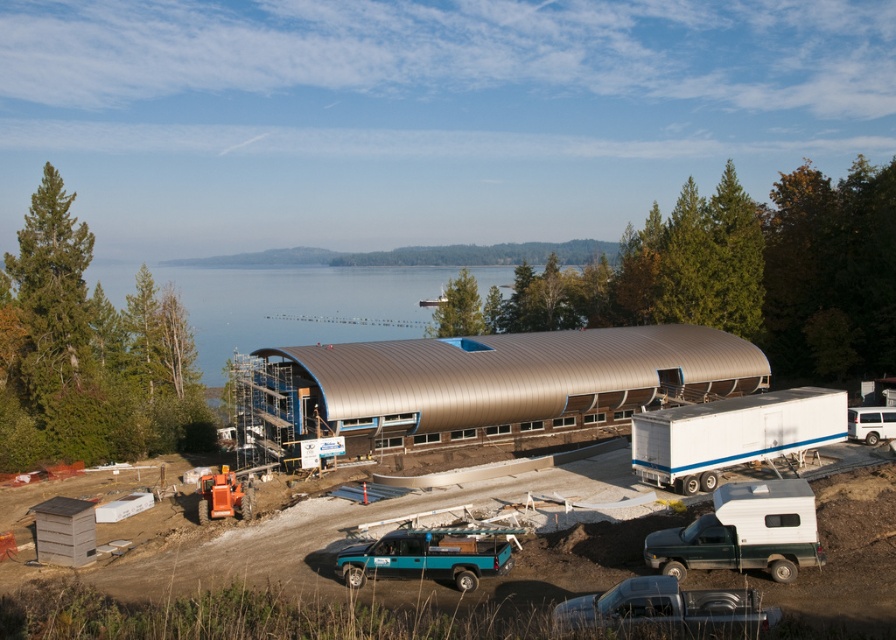
Is metallic water at center thinner than teal matte truck at lower center?

No.

Who is positioned more to the right, metallic water at center or teal matte truck at lower center?

teal matte truck at lower center

Which is in front, point (336, 273) or point (480, 554)?

Positioned in front is point (480, 554).

You are a GUI agent. You are given a task and a screenshot of the screen. Output one action in this format:
    pyautogui.click(x=<x>, y=<y>)
    Task: Click on the metallic water at center
    
    Given the screenshot: What is the action you would take?
    pyautogui.click(x=299, y=305)

Who is positioned more to the right, green matte truck at lower right or teal matte truck at lower center?

From the viewer's perspective, green matte truck at lower right appears more on the right side.

Where is `green matte truck at lower right`? green matte truck at lower right is located at coordinates [744, 532].

Who is positioned more to the left, white matte trailer truck at right or green matte truck at lower right?

green matte truck at lower right is more to the left.

Is white matte trailer truck at right below green matte truck at lower right?

No.

Does point (831, 417) lie behind point (658, 536)?

Yes, it is behind point (658, 536).

Where is `white matte trailer truck at right`? This screenshot has width=896, height=640. white matte trailer truck at right is located at coordinates (731, 433).